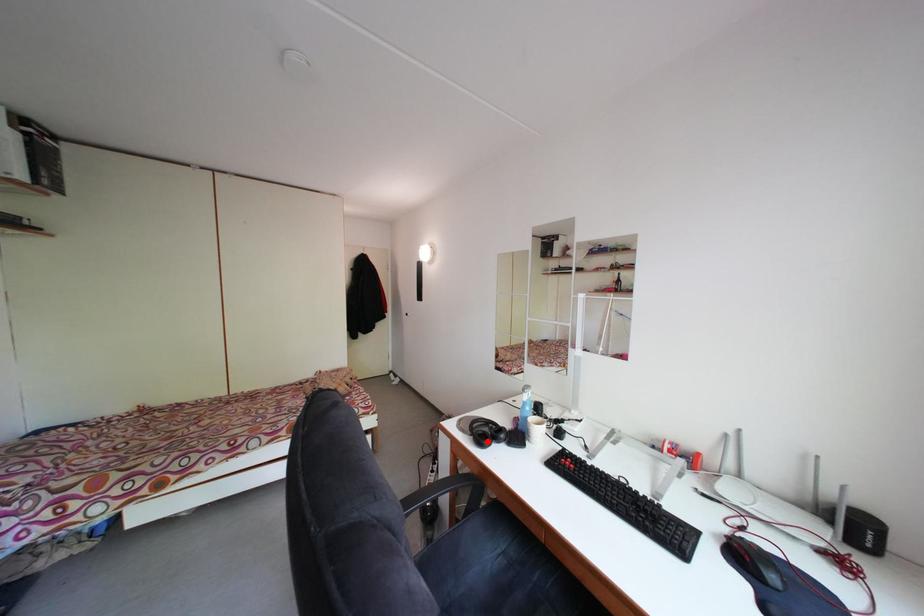
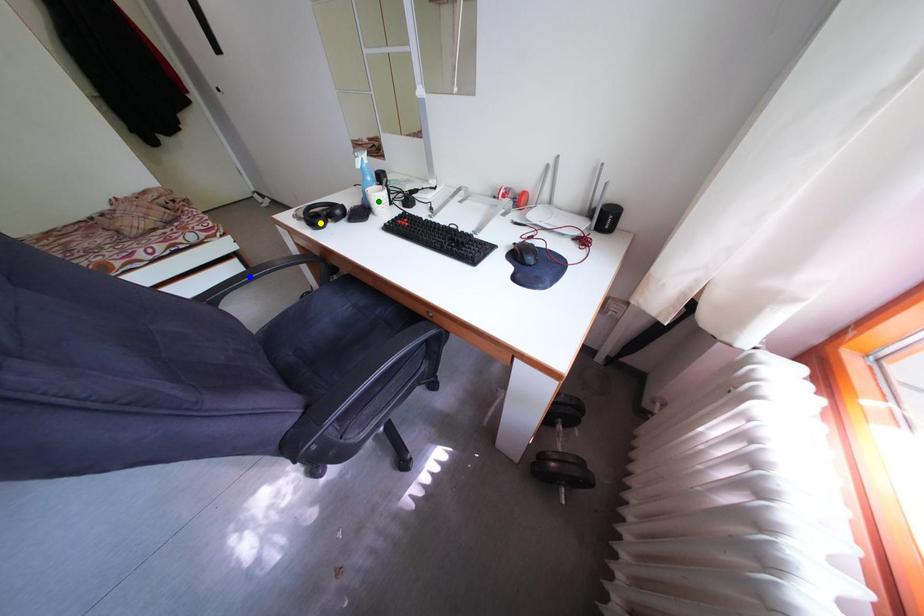
Question: I am providing you with two images of the same scene from different viewpoints. A red point is marked on the first image. You are given multiple points on the second image. Which mark in image 2 goes with the point in image 1?

Choices:
 (A) green point
 (B) yellow point
 (C) blue point

Answer: (B)